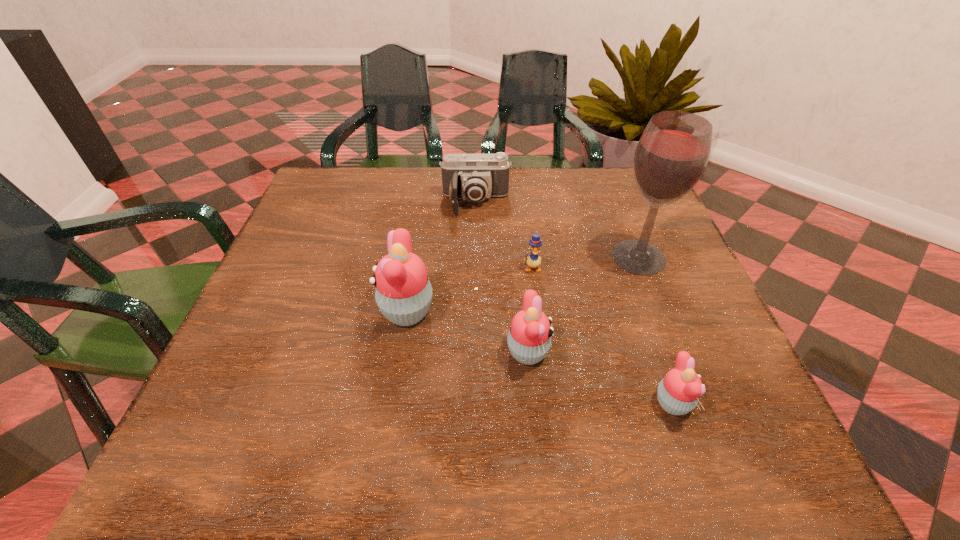
Find the location of `vacant area between the second tallest object and the farthest object`. vacant area between the second tallest object and the farthest object is located at coordinates (442, 257).

Find the location of a particular element. Image resolution: width=960 pixels, height=540 pixels. unoccupied area between the second cupcake from left to right and the farthest object is located at coordinates (502, 278).

Identify the location of empty space between the farthest object and the tallest object. This screenshot has height=540, width=960. (557, 230).

Where is `vacant space that's between the second shortest cupcake and the tallest object`? The image size is (960, 540). vacant space that's between the second shortest cupcake and the tallest object is located at coordinates 583,305.

Find the location of a particular element. The height and width of the screenshot is (540, 960). vacant space that's between the second cupcake from right to left and the shortest cupcake is located at coordinates (600, 378).

Find the location of a particular element. This screenshot has height=540, width=960. object that is the second closest to the fifth shortest object is located at coordinates (533, 261).

Choose which object is the fifth nearest neighbor to the leftmost cupcake. Please provide its 2D coordinates. Your answer should be formatted as a tuple, i.e. [(x, y)], where the tuple contains the x and y coordinates of a point satisfying the conditions above.

[(678, 393)]

Identify which cupcake is the closest to the camera. Please provide its 2D coordinates. Your answer should be formatted as a tuple, i.e. [(x, y)], where the tuple contains the x and y coordinates of a point satisfying the conditions above.

[(403, 293)]

Identify which cupcake is the third closest to the farthest object. Please provide its 2D coordinates. Your answer should be formatted as a tuple, i.e. [(x, y)], where the tuple contains the x and y coordinates of a point satisfying the conditions above.

[(678, 393)]

You are a GUI agent. You are given a task and a screenshot of the screen. Output one action in this format:
    pyautogui.click(x=<x>, y=<y>)
    Task: Click on the free space that satisfies the following two spatial constraints: 1. at the front of the tallest object with an open lens cover; 2. on the left side of the camera
    
    Given the screenshot: What is the action you would take?
    pyautogui.click(x=475, y=257)